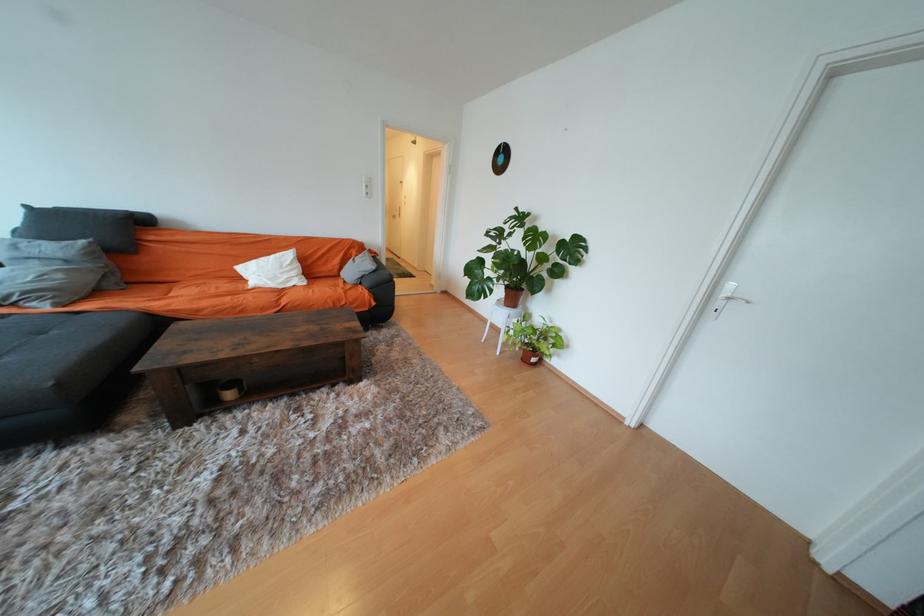
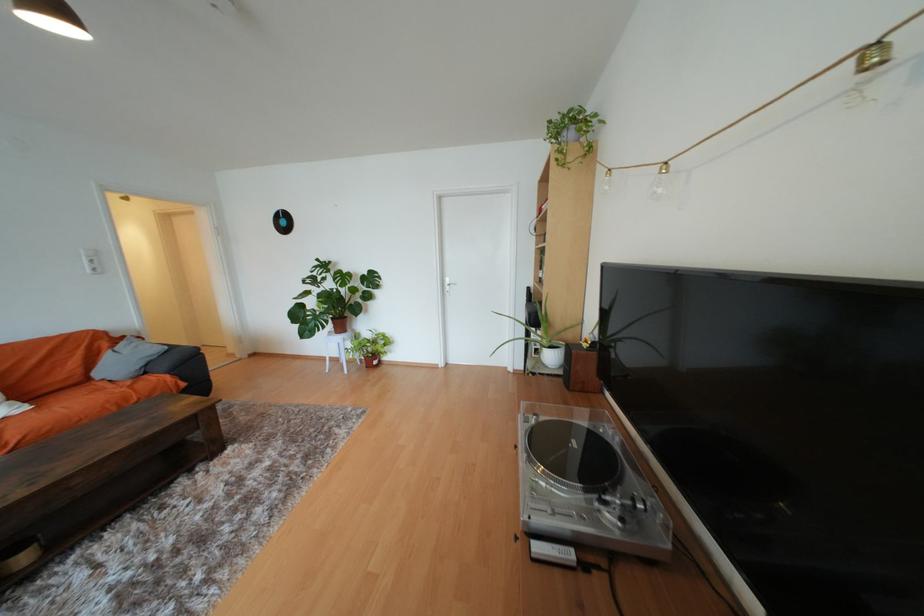
Find the pixel in the second image that matches (372,195) in the first image.

(101, 270)